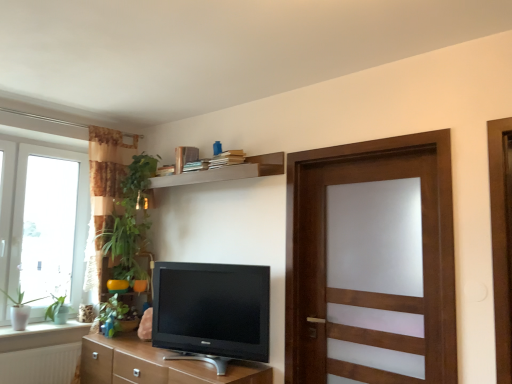
Describe the element at coordinates (46, 329) in the screenshot. I see `white ceramic window sill at lower left` at that location.

Where is `white ceramic window sill at lower left`? white ceramic window sill at lower left is located at coordinates (46, 329).

You are a GUI agent. You are given a task and a screenshot of the screen. Output one action in this format:
    pyautogui.click(x=<x>, y=<y>)
    Task: Click on the green matte plant at left, marked as the 3th plant in a right-to-left arrangement
    The height and width of the screenshot is (384, 512).
    Given the screenshot: What is the action you would take?
    pyautogui.click(x=20, y=310)

You are a GUI agent. You are given a task and a screenshot of the screen. Output one action in this format:
    pyautogui.click(x=<x>, y=<y>)
    Task: Click on the wooden door at right
    
    Given the screenshot: What is the action you would take?
    pyautogui.click(x=366, y=292)

What do you see at coordinates (110, 317) in the screenshot?
I see `green matte plant at lower left, which ranks as the 2th plant in left-to-right order` at bounding box center [110, 317].

Where is `brown wood cabinet at lower center`? The width and height of the screenshot is (512, 384). brown wood cabinet at lower center is located at coordinates (156, 365).

The image size is (512, 384). Find the location of `wooden shelf at upper center`. wooden shelf at upper center is located at coordinates tap(227, 172).

The height and width of the screenshot is (384, 512). Identify the location of green leafy plant at left, arranged as the first plant when viewed from the right. (125, 240).

What do you see at coordinates (125, 240) in the screenshot?
I see `green leafy plant at left, arranged as the first plant when viewed from the right` at bounding box center [125, 240].

Identify the location of white ceramic window sill at lower left. This screenshot has height=384, width=512. (46, 329).

Does point (52, 332) appear closer or farther from the camera than point (151, 355)?

Point (52, 332).

Can you confirm if white ceramic window sill at lower left is positioned to the right of brown wood cabinet at lower center?

No, white ceramic window sill at lower left is not to the right of brown wood cabinet at lower center.

Where is `window sill lying behind the brown wood cabinet at lower center`? The height and width of the screenshot is (384, 512). window sill lying behind the brown wood cabinet at lower center is located at coordinates (46, 329).

Considering the sizes of white ceramic window sill at lower left and brown wood cabinet at lower center in the image, is white ceramic window sill at lower left taller or shorter than brown wood cabinet at lower center?

white ceramic window sill at lower left is shorter than brown wood cabinet at lower center.

Is wooden shelf at upper center bigger or smaller than wooden door at right?

In the image, wooden shelf at upper center appears to be smaller than wooden door at right.

Considering the relative sizes of wooden shelf at upper center and wooden door at right in the image provided, is wooden shelf at upper center wider than wooden door at right?

Incorrect, the width of wooden shelf at upper center does not surpass that of wooden door at right.

How distant is wooden shelf at upper center from wooden door at right?

The distance of wooden shelf at upper center from wooden door at right is 29.20 inches.

Does point (281, 164) appear closer or farther from the camera than point (338, 331)?

Point (281, 164) appears to be farther away from the viewer than point (338, 331).

From a real-world perspective, is white ceramic window sill at lower left over white glass window at left?

No.

Is white ceramic window sill at lower left behind white glass window at left?

Yes, white ceramic window sill at lower left is behind white glass window at left.

From the image's perspective, which one is positioned lower, white ceramic window sill at lower left or white glass window at left?

white ceramic window sill at lower left.

Which is behind, point (81, 336) or point (31, 166)?

The point (31, 166) is farther.

In the scene shown: Considering the relative positions of matte black tv at center and wooden shelf at upper center in the image provided, is matte black tv at center to the left or to the right of wooden shelf at upper center?

Based on their positions, matte black tv at center is located to the right of wooden shelf at upper center.

Can you confirm if matte black tv at center is thinner than wooden shelf at upper center?

In fact, matte black tv at center might be wider than wooden shelf at upper center.

Considering the relative positions of matte black tv at center and wooden shelf at upper center in the image provided, is matte black tv at center in front of wooden shelf at upper center?

Yes, it is.

Which is more to the left, white ceramic window sill at lower left or green matte plant at left, which appears as the first plant when viewed from the left?

green matte plant at left, which appears as the first plant when viewed from the left.

Would you consider white ceramic window sill at lower left to be distant from green matte plant at left, marked as the 3th plant in a right-to-left arrangement?

No, there isn't a large distance between white ceramic window sill at lower left and green matte plant at left, marked as the 3th plant in a right-to-left arrangement.

Is white ceramic window sill at lower left inside or outside of green matte plant at left, marked as the 3th plant in a right-to-left arrangement?

white ceramic window sill at lower left is outside green matte plant at left, marked as the 3th plant in a right-to-left arrangement.

Between wooden door at right and wooden shelf at upper center, which one has more height?

Standing taller between the two is wooden door at right.

Based on the photo, how many degrees apart are the facing directions of wooden door at right and wooden shelf at upper center?

89.9 degrees separate the facing orientations of wooden door at right and wooden shelf at upper center.

From the picture: Do you think wooden door at right is within wooden shelf at upper center, or outside of it?

wooden door at right is outside wooden shelf at upper center.

Between point (444, 293) and point (13, 325), which one is positioned behind?

The point (13, 325) is farther.

Looking at the image, does wooden door at right seem bigger or smaller compared to green matte plant at left, which appears as the first plant when viewed from the left?

In the image, wooden door at right appears to be larger than green matte plant at left, which appears as the first plant when viewed from the left.

Which is more to the right, wooden door at right or green matte plant at left, which appears as the first plant when viewed from the left?

wooden door at right is more to the right.

Considering the sizes of objects wooden door at right and green matte plant at left, which appears as the first plant when viewed from the left, in the image provided, who is shorter, wooden door at right or green matte plant at left, which appears as the first plant when viewed from the left,?

green matte plant at left, which appears as the first plant when viewed from the left, is shorter.

In order to click on cabinetry lying on the right of white ceramic window sill at lower left in this screenshot , I will do `click(156, 365)`.

You are a GUI agent. You are given a task and a screenshot of the screen. Output one action in this format:
    pyautogui.click(x=<x>, y=<y>)
    Task: Click on the shelf above the wooden door at right (from the image's perspective)
    Image resolution: width=512 pixels, height=384 pixels.
    Given the screenshot: What is the action you would take?
    pyautogui.click(x=227, y=172)

Looking at the image, which one is located closer to white ceramic window sill at lower left, green matte plant at lower left, placed as the 2th plant when sorted from right to left, or green matte plant at left, which appears as the first plant when viewed from the left?

Based on the image, green matte plant at left, which appears as the first plant when viewed from the left, appears to be nearer to white ceramic window sill at lower left.

Looking at the image, which one is located further to green matte plant at left, which appears as the first plant when viewed from the left, white glass window at left or wooden shelf at upper center?

wooden shelf at upper center.

Which object lies nearer to the anchor point white ceramic window sill at lower left, matte black tv at center or brown wood cabinet at lower center?

brown wood cabinet at lower center is positioned closer to the anchor white ceramic window sill at lower left.

Looking at the image, which one is located further to green matte plant at lower left, which ranks as the 2th plant in left-to-right order, white glass window at left or wooden door at right?

The object further to green matte plant at lower left, which ranks as the 2th plant in left-to-right order, is wooden door at right.

When comparing their distances from wooden shelf at upper center, does white glass window at left or wooden door at right seem closer?

Among the two, wooden door at right is located nearer to wooden shelf at upper center.

Considering their positions, is green matte plant at left, which appears as the first plant when viewed from the left, positioned closer to green leafy plant at left, the third plant viewed from the left, than green matte plant at lower left, placed as the 2th plant when sorted from right to left?

green matte plant at lower left, placed as the 2th plant when sorted from right to left.

Considering their positions, is white ceramic window sill at lower left positioned closer to white glass window at left than brown wood cabinet at lower center?

The object closer to white glass window at left is white ceramic window sill at lower left.

Which object lies further to the anchor point green leafy plant at left, arranged as the first plant when viewed from the right, wooden shelf at upper center or white glass window at left?

The object further to green leafy plant at left, arranged as the first plant when viewed from the right, is white glass window at left.

Identify the location of television situated between wooden shelf at upper center and wooden door at right from left to right. This screenshot has height=384, width=512. (211, 312).

Locate an element on the screen. window situated between green matte plant at left, marked as the 3th plant in a right-to-left arrangement, and brown wood cabinet at lower center from left to right is located at coordinates (42, 221).

You are a GUI agent. You are given a task and a screenshot of the screen. Output one action in this format:
    pyautogui.click(x=<x>, y=<y>)
    Task: Click on the shelf between white ceramic window sill at lower left and wooden door at right
    The image size is (512, 384).
    Given the screenshot: What is the action you would take?
    pyautogui.click(x=227, y=172)

The height and width of the screenshot is (384, 512). Identify the location of television situated between white ceramic window sill at lower left and wooden door at right from left to right. coord(211,312).